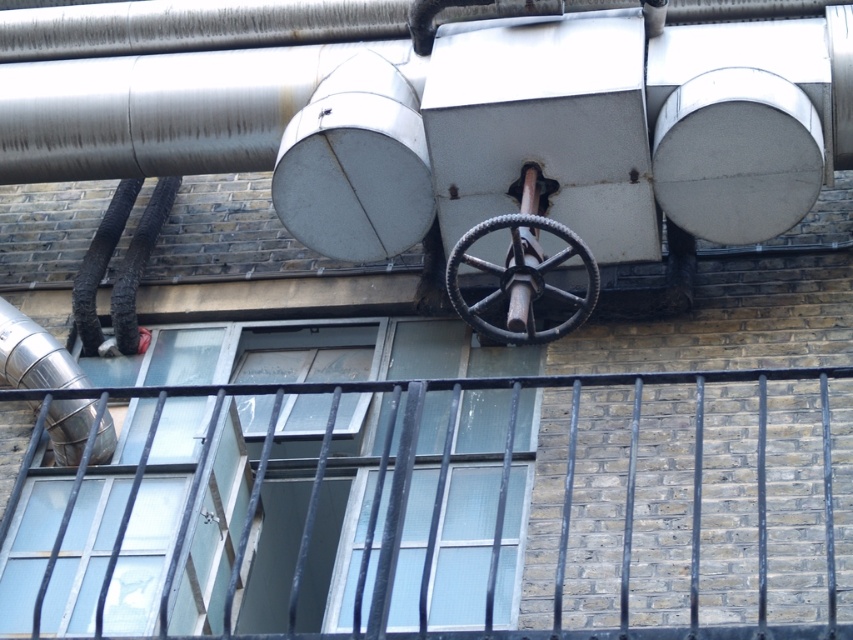
Between black metal railing at center and rubber textured wheel at center, which one appears on the left side from the viewer's perspective?

black metal railing at center

How distant is black metal railing at center from rubber textured wheel at center?

8.48 feet

Which is in front, point (387, 440) or point (527, 228)?

Point (387, 440)

Where is `black metal railing at center`? Image resolution: width=853 pixels, height=640 pixels. black metal railing at center is located at coordinates (564, 474).

Where is `black metal railing at center`? The image size is (853, 640). black metal railing at center is located at coordinates (564, 474).

Who is more forward, (631, 492) or (15, 321)?

Point (631, 492)

Is point (641, 384) closer to viewer compared to point (57, 456)?

Yes, point (641, 384) is closer to viewer.

The height and width of the screenshot is (640, 853). Find the location of `black metal railing at center`. black metal railing at center is located at coordinates (564, 474).

Based on the photo, between rubber textured wheel at center and brushed metal water pipe at left, which one is positioned higher?

Positioned higher is rubber textured wheel at center.

Who is more forward, [480,314] or [51,387]?

Point [480,314]

Between point (527, 300) and point (74, 436), which one is positioned behind?

Point (74, 436)

Where is `rubber textured wheel at center`? This screenshot has width=853, height=640. rubber textured wheel at center is located at coordinates (521, 280).